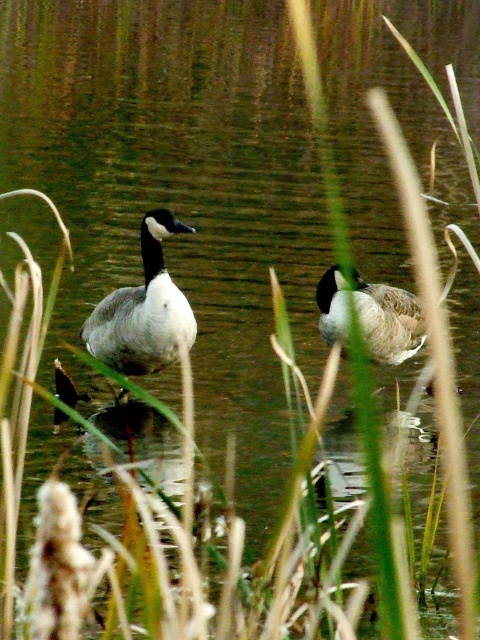
Can you confirm if white matte duck at center is bigger than gray matte duck at center?

Yes.

What do you see at coordinates (143, 308) in the screenshot? The width and height of the screenshot is (480, 640). I see `white matte duck at center` at bounding box center [143, 308].

Identify the location of white matte duck at center. (143, 308).